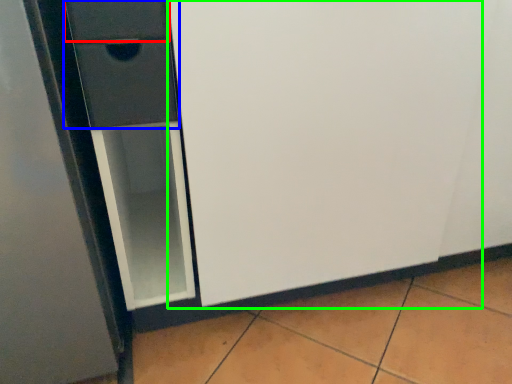
Question: Which object is positioned farthest from drawer (highlighted by a red box)? Select from drawer (highlighted by a blue box) and screen door (highlighted by a green box).

Choices:
 (A) drawer
 (B) screen door

Answer: (B)